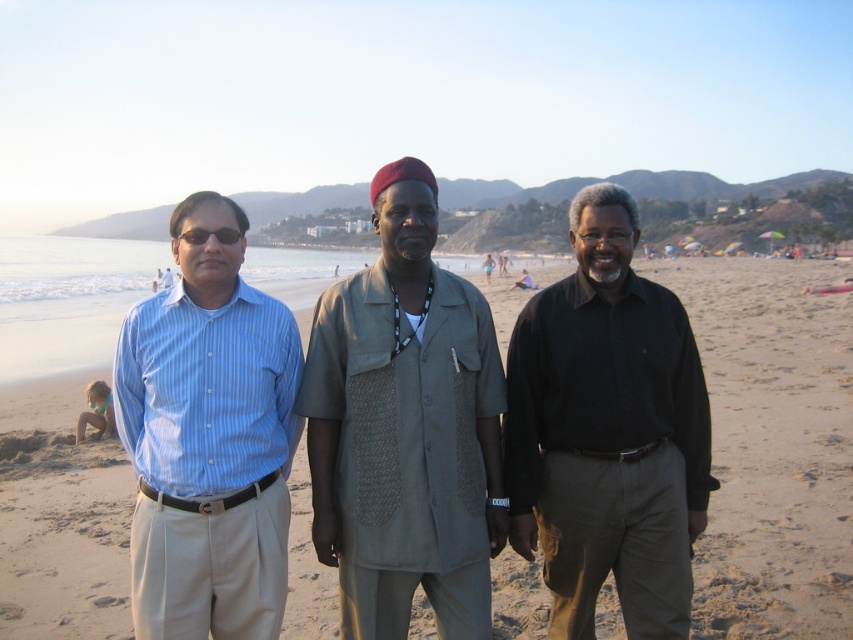
Between khaki textured shirt at center and blue striped shirt at left, which one has less height?

Standing shorter between the two is blue striped shirt at left.

Can you confirm if khaki textured shirt at center is thinner than blue striped shirt at left?

In fact, khaki textured shirt at center might be wider than blue striped shirt at left.

Image resolution: width=853 pixels, height=640 pixels. Describe the element at coordinates (405, 428) in the screenshot. I see `khaki textured shirt at center` at that location.

Identify the location of khaki textured shirt at center. The height and width of the screenshot is (640, 853). (405, 428).

Looking at this image, does beige sand at center have a lesser width compared to blue striped shirt at left?

Incorrect, beige sand at center's width is not less than blue striped shirt at left's.

Is point (700, 262) positioned in front of point (161, 561)?

That is False.

Who is more distant from viewer, (830, 269) or (202, 497)?

The point (830, 269) is behind.

Identify the location of beige sand at center. The height and width of the screenshot is (640, 853). (772, 445).

From the picture: Between beige sand at center and black matte shirt at center, which one appears on the right side from the viewer's perspective?

beige sand at center

Who is more distant from viewer, (548, 278) or (608, 522)?

The point (548, 278) is more distant.

Which is in front, point (762, 308) or point (675, 438)?

Point (675, 438) is more forward.

You are a GUI agent. You are given a task and a screenshot of the screen. Output one action in this format:
    pyautogui.click(x=<x>, y=<y>)
    Task: Click on the beige sand at center
    This screenshot has height=640, width=853.
    Given the screenshot: What is the action you would take?
    pyautogui.click(x=772, y=445)